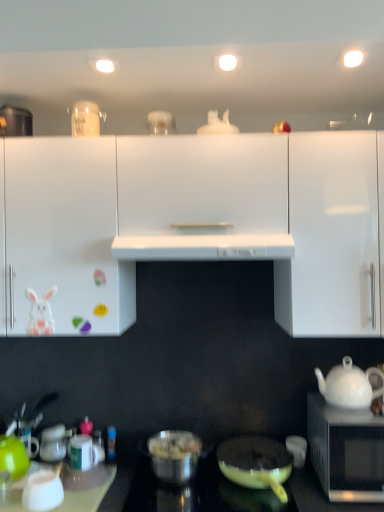
Question: Is point (1, 457) closer or farther from the camera than point (91, 279)?

Choices:
 (A) farther
 (B) closer

Answer: (A)

Question: In terms of size, does green matte coffee cup at lower left, which is counted as the fourth coffee cup, starting from the right, appear bigger or smaller than white glossy cabinet at left, the 3th cabinetry positioned from the right?

Choices:
 (A) big
 (B) small

Answer: (B)

Question: Considering the real-world distances, which object is farthest from the white glossy rabbit at left?

Choices:
 (A) white glossy coffee cup at lower right, which is counted as the 4th coffee cup, starting from the left
 (B) green matte coffee cup at lower left, which ranks as the first coffee cup in left-to-right order
 (C) white glossy teapot at right
 (D) black matte microwave at lower right
 (E) shiny metallic pot at center, the 2th pot/pan when ordered from right to left

Answer: (D)

Question: Estimate the real-world distances between objects in this image. Which object is closer to the white glossy coffee cup at lower left, which is the 3th coffee cup in right-to-left order?

Choices:
 (A) green matte coffee cup at lower left, the 3th coffee cup viewed from the left
 (B) green matte coffee cup at lower left, which is counted as the fourth coffee cup, starting from the right
 (C) glossy white cabinet at upper right, the 3th cabinetry positioned from the left
 (D) white glossy coffee cup at lower right, the first coffee cup in the right-to-left sequence
 (E) white glossy exhaust hood at center

Answer: (A)